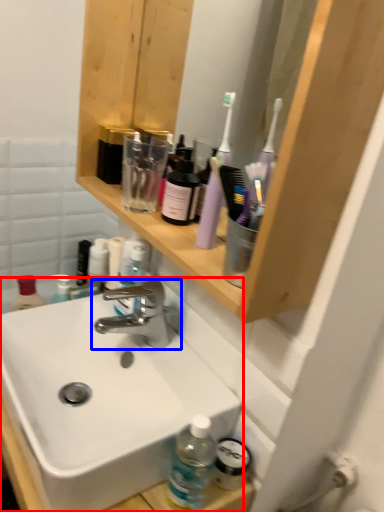
Question: Which object appears farthest to the camera in this image, sink (highlighted by a red box) or tap (highlighted by a blue box)?

Choices:
 (A) sink
 (B) tap

Answer: (B)